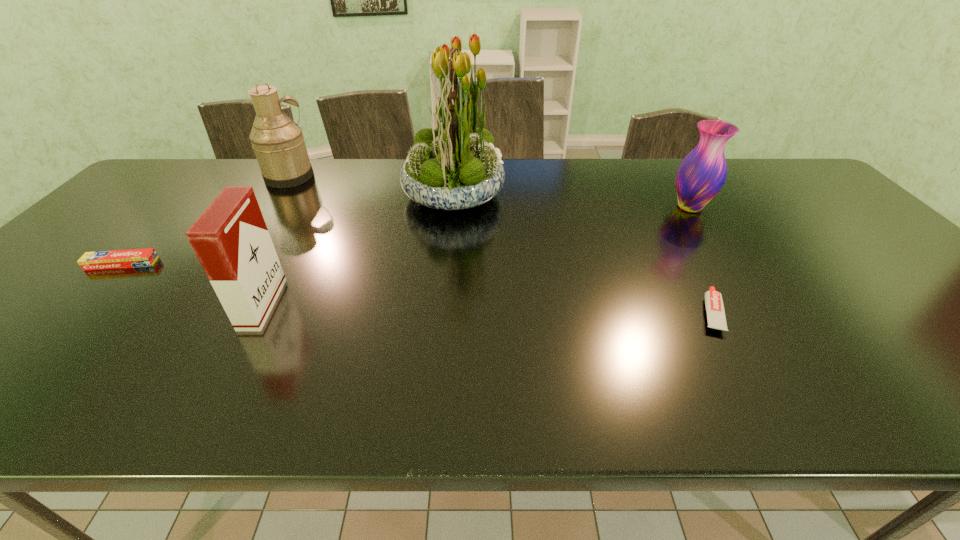
I want to click on the tallest object, so click(453, 167).

Locate an element on the screen. This screenshot has width=960, height=540. flower arrangement is located at coordinates (453, 167).

Where is `the fifth shortest object`? The width and height of the screenshot is (960, 540). the fifth shortest object is located at coordinates (278, 142).

Find the location of a particular element. The width and height of the screenshot is (960, 540). the second object from left to right is located at coordinates (278, 142).

The height and width of the screenshot is (540, 960). I want to click on the fourth object from right to left, so click(x=231, y=240).

The height and width of the screenshot is (540, 960). What are the coordinates of `the rightmost object` in the screenshot? It's located at (700, 176).

Where is `the farther toothpaste`? the farther toothpaste is located at coordinates (100, 260).

The height and width of the screenshot is (540, 960). Find the location of `the third nearest object`. the third nearest object is located at coordinates (100, 260).

The width and height of the screenshot is (960, 540). I want to click on the nearer toothpaste, so click(x=716, y=318).

I want to click on the second object from right to left, so click(x=716, y=318).